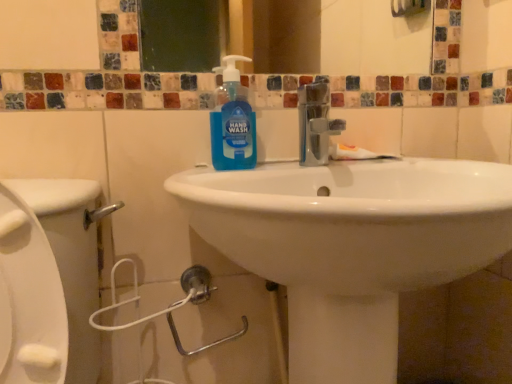
What is the approximate height of white glossy sink at center?

The height of white glossy sink at center is 27.22 inches.

Locate an element on the screen. The width and height of the screenshot is (512, 384). blue translucent hand wash at center is located at coordinates (233, 122).

Considering the positions of points (365, 364) and (217, 137), is point (365, 364) closer to camera compared to point (217, 137)?

That is True.

Find the location of `sink in front of the blue translucent hand wash at center`. sink in front of the blue translucent hand wash at center is located at coordinates (350, 240).

Consider the image. Considering the sizes of objects white glossy sink at center and blue translucent hand wash at center in the image provided, who is bigger, white glossy sink at center or blue translucent hand wash at center?

white glossy sink at center.

Between white matte toothpaste at center and blue translucent hand wash at center, which one appears on the right side from the viewer's perspective?

Positioned to the right is white matte toothpaste at center.

Relative to blue translucent hand wash at center, is white matte toothpaste at center in front or behind?

Visually, white matte toothpaste at center is located behind blue translucent hand wash at center.

Is point (360, 150) in front of point (245, 115)?

That is False.

Consider the image. Is blue translucent hand wash at center located outside white matte toothpaste at center?

Indeed, blue translucent hand wash at center is completely outside white matte toothpaste at center.

Is blue translucent hand wash at center bigger or smaller than white matte toothpaste at center?

In the image, blue translucent hand wash at center appears to be larger than white matte toothpaste at center.

Are blue translucent hand wash at center and white matte toothpaste at center located far from each other?

No, blue translucent hand wash at center is not far from white matte toothpaste at center.

Based on the photo, is blue translucent hand wash at center looking in the opposite direction of white matte toothpaste at center?

No, blue translucent hand wash at center is not facing the opposite direction of white matte toothpaste at center.

Between blue translucent hand wash at center and white glossy sink at center, which one appears on the left side from the viewer's perspective?

Positioned to the left is blue translucent hand wash at center.

From the image's perspective, who appears lower, blue translucent hand wash at center or white glossy sink at center?

white glossy sink at center, from the image's perspective.

From the picture: Does blue translucent hand wash at center have a lesser height compared to white glossy sink at center?

Indeed, blue translucent hand wash at center has a lesser height compared to white glossy sink at center.

Is blue translucent hand wash at center in front of white glossy sink at center?

No, blue translucent hand wash at center is behind white glossy sink at center.

From the picture: From the image's perspective, which is below, white glossy sink at center or white matte toothpaste at center?

white glossy sink at center, from the image's perspective.

Based on the photo, visually, is white glossy sink at center positioned to the left or to the right of white matte toothpaste at center?

In the image, white glossy sink at center appears on the left side of white matte toothpaste at center.

Who is shorter, white glossy sink at center or white matte toothpaste at center?

With less height is white matte toothpaste at center.

Locate an element on the screen. The width and height of the screenshot is (512, 384). toothpaste located above the white glossy sink at center (from a real-world perspective) is located at coordinates (356, 154).

From a real-world perspective, is white matte toothpaste at center located higher than white glossy sink at center?

Yes, from a real-world perspective, white matte toothpaste at center is above white glossy sink at center.

Between white matte toothpaste at center and white glossy sink at center, which one has larger width?

Wider between the two is white glossy sink at center.

Considering the relative sizes of white matte toothpaste at center and white glossy sink at center in the image provided, is white matte toothpaste at center smaller than white glossy sink at center?

Yes.

Is point (349, 158) positioned after point (386, 229)?

Yes.

Where is `sink below the blue translucent hand wash at center (from the image's perspective)`? sink below the blue translucent hand wash at center (from the image's perspective) is located at coordinates (350, 240).

The width and height of the screenshot is (512, 384). Identify the location of toothpaste that appears below the blue translucent hand wash at center (from a real-world perspective). (356, 154).

Which object lies further to the anchor point white glossy sink at center, white matte toothpaste at center or blue translucent hand wash at center?

Based on the image, white matte toothpaste at center appears to be further to white glossy sink at center.

From the image, which object appears to be farther from blue translucent hand wash at center, white matte toothpaste at center or white glossy sink at center?

white glossy sink at center.

Estimate the real-world distances between objects in this image. Which object is closer to white glossy sink at center, blue translucent hand wash at center or white matte toothpaste at center?

blue translucent hand wash at center lies closer to white glossy sink at center than the other object.

Estimate the real-world distances between objects in this image. Which object is further from white matte toothpaste at center, blue translucent hand wash at center or white glossy sink at center?

white glossy sink at center.

Estimate the real-world distances between objects in this image. Which object is closer to blue translucent hand wash at center, white glossy sink at center or white matte toothpaste at center?

white matte toothpaste at center is positioned closer to the anchor blue translucent hand wash at center.

When comparing their distances from white matte toothpaste at center, does white glossy sink at center or blue translucent hand wash at center seem further?

Based on the image, white glossy sink at center appears to be further to white matte toothpaste at center.

Where is `cleaning product located between white glossy sink at center and white matte toothpaste at center in the depth direction`? The width and height of the screenshot is (512, 384). cleaning product located between white glossy sink at center and white matte toothpaste at center in the depth direction is located at coordinates (233, 122).